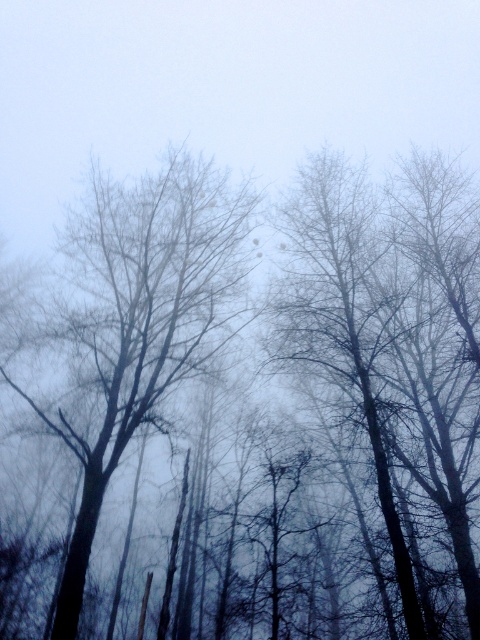
In the foggy forest scene with a muted sky and tall slender trees, there is a point marked at coordinates (x=396, y=356). What object is located at this point?

The point at coordinates (x=396, y=356) indicates a dark brown bark tree at center.

You are a hiker in the foggy forest and want to reach the dark brown bark tree at center. If you are currently at point 0.5, 0.8, which direction should you move to reach it?

The dark brown bark tree at center is located at point (396, 356). Since you are at (384, 320), you should move northeast to reach it.

You are a hiker who wants to measure the distance between two objects in the foggy forest. You have a measuring tape that can extend up to 20 feet. Can you safely measure the distance between the dark brown bark tree at center and the bare branches at center using your tape?

The distance between the dark brown bark tree at center and the bare branches at center is 19.09 feet, which is within the 20 feet limit of your measuring tape. Therefore, you can safely measure the distance using your tape.